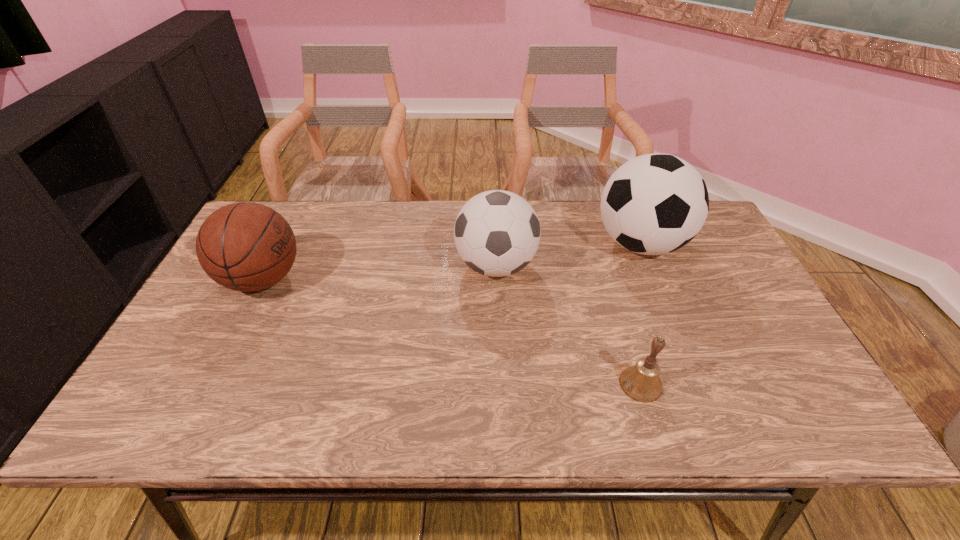
This screenshot has height=540, width=960. What are the coordinates of `free space that satisfies the following two spatial constraints: 1. on the back side of the bell; 2. on the side with brand label of the leftmost object` in the screenshot? It's located at (x=610, y=279).

Identify the location of free space that satisfies the following two spatial constraints: 1. on the side with brand label of the nearest object; 2. on the right side of the leftmost object. click(210, 384).

The image size is (960, 540). What are the coordinates of `blank space that satisfies the following two spatial constraints: 1. on the front side of the tallest object; 2. on the side with brand label of the basketball` in the screenshot? It's located at (655, 279).

I want to click on vacant point that satisfies the following two spatial constraints: 1. on the side with brand label of the basketball; 2. on the right side of the nearest object, so click(x=210, y=384).